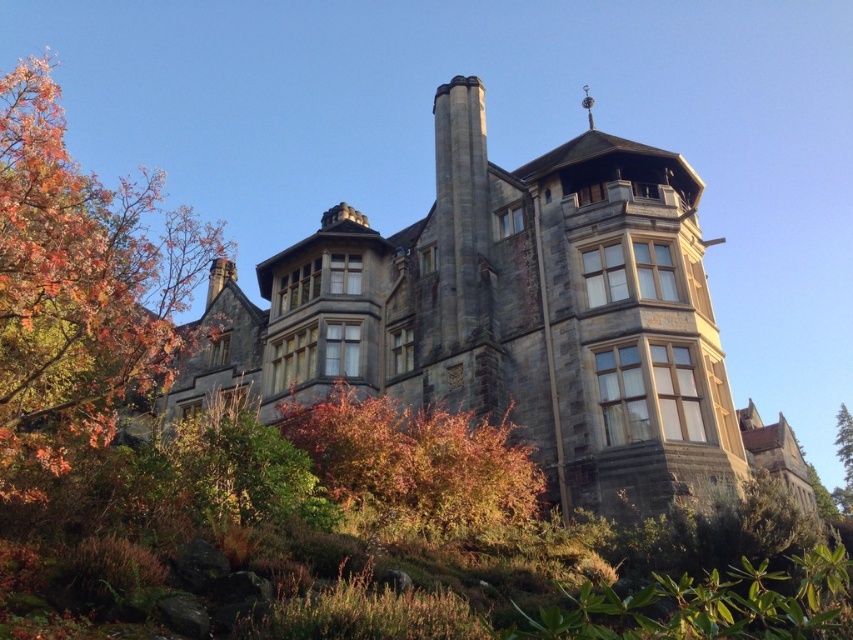
You are standing in front of the Victorian building and notice autumn leaves at left and a green leafy tree at right. Which object is closer to you?

The autumn leaves at left are closer to you because they are in front of the green leafy tree at right.

You are an architect analyzing the building facade. You notice autumn leaves at left and autumn leaves bush at center. Which one has a greater area coverage on the ground?

The autumn leaves at left has a greater area coverage on the ground than the autumn leaves bush at center because it is larger in size.